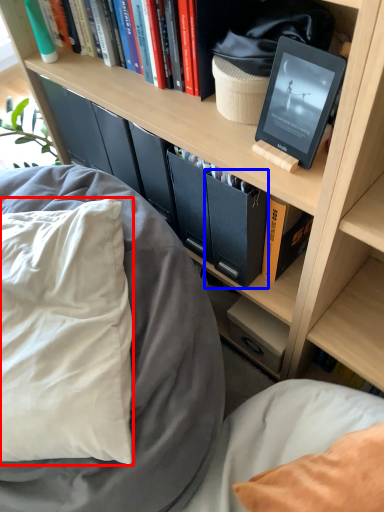
Question: Which object is further to the camera taking this photo, pillow (highlighted by a red box) or paperback book (highlighted by a blue box)?

Choices:
 (A) pillow
 (B) paperback book

Answer: (B)